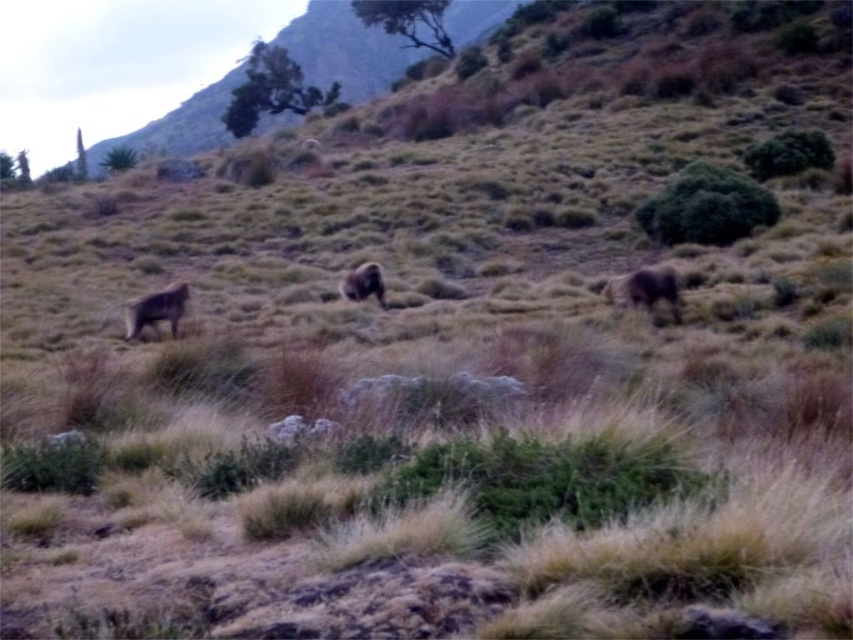
You are a wildlife photographer trying to capture a photo of the fuzzy brown bear at lower left and the brown furry animal at center. You need to ensure both subjects are in frame. Based on their sizes, which animal should you focus on first to ensure they are fully visible in your shot?

The fuzzy brown bear at lower left might be wider than brown furry animal at center, so you should focus on the fuzzy brown bear at lower left first to ensure it fits within the frame due to its potentially larger width.

You are a wildlife photographer aiming to capture a photo of the brown furry animal at right and the brown furry animal at center. Which of the two animals is taller?

The brown furry animal at right is taller than the brown furry animal at center.

In the image, there is a point labeled as point (344, 51). Based on the scene description, what does this point most likely represent?

The point (344, 51) corresponds to dry grass at upper center.